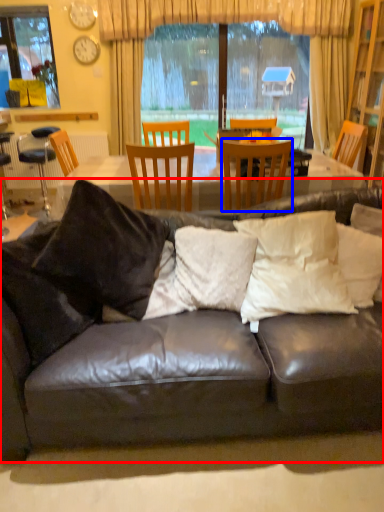
Question: Which object appears closest to the camera in this image, studio couch (highlighted by a red box) or chair (highlighted by a blue box)?

Choices:
 (A) studio couch
 (B) chair

Answer: (A)